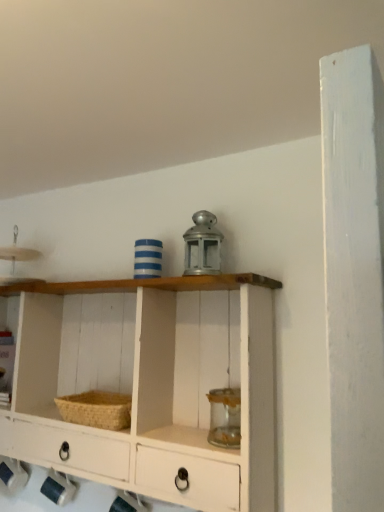
Question: Can you confirm if woven straw basket at lower left is shorter than white painted wood shelf at center?

Choices:
 (A) no
 (B) yes

Answer: (B)

Question: Is woven straw basket at lower left far away from white painted wood shelf at center?

Choices:
 (A) no
 (B) yes

Answer: (A)

Question: Would you say white painted wood shelf at center is part of woven straw basket at lower left's contents?

Choices:
 (A) no
 (B) yes

Answer: (A)

Question: Considering the relative sizes of woven straw basket at lower left and white painted wood shelf at center in the image provided, is woven straw basket at lower left taller than white painted wood shelf at center?

Choices:
 (A) no
 (B) yes

Answer: (A)

Question: Considering the relative positions of woven straw basket at lower left and white painted wood shelf at center in the image provided, is woven straw basket at lower left to the right of white painted wood shelf at center from the viewer's perspective?

Choices:
 (A) yes
 (B) no

Answer: (A)

Question: Could you tell me if woven straw basket at lower left is turned towards white painted wood shelf at center?

Choices:
 (A) yes
 (B) no

Answer: (A)

Question: Is white painted wood shelf at center looking in the opposite direction of woven straw basket at lower left?

Choices:
 (A) no
 (B) yes

Answer: (B)

Question: Is white painted wood shelf at center not near woven straw basket at lower left?

Choices:
 (A) yes
 (B) no

Answer: (B)

Question: Is white painted wood shelf at center to the left of woven straw basket at lower left from the viewer's perspective?

Choices:
 (A) yes
 (B) no

Answer: (A)

Question: From a real-world perspective, is white painted wood shelf at center physically below woven straw basket at lower left?

Choices:
 (A) no
 (B) yes

Answer: (A)

Question: Is white painted wood shelf at center bigger than woven straw basket at lower left?

Choices:
 (A) no
 (B) yes

Answer: (B)

Question: Would you say white painted wood shelf at center contains woven straw basket at lower left?

Choices:
 (A) yes
 (B) no

Answer: (A)

Question: From a real-world perspective, is white painted wood shelf at center positioned above or below woven straw basket at lower left?

Choices:
 (A) above
 (B) below

Answer: (A)